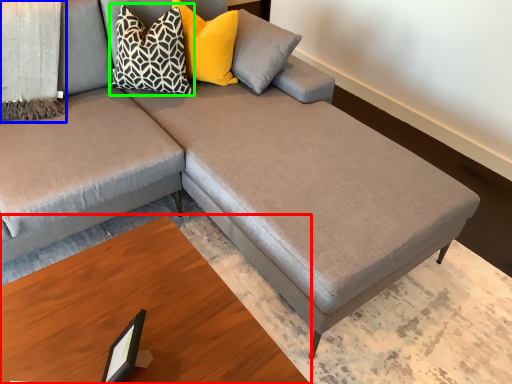
Question: Considering the real-world distances, which object is farthest from table (highlighted by a red box)? blanket (highlighted by a blue box) or pillow (highlighted by a green box)?

Choices:
 (A) blanket
 (B) pillow

Answer: (A)